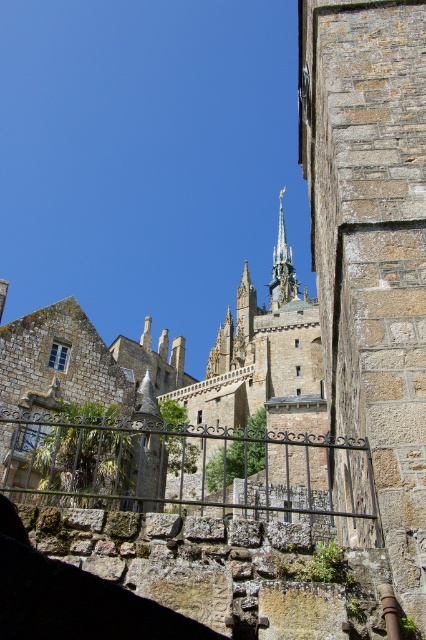
Question: Does stone medieval castle at center appear under polished bronze spire at center?

Choices:
 (A) yes
 (B) no

Answer: (A)

Question: Does stone medieval castle at center come behind polished bronze spire at center?

Choices:
 (A) no
 (B) yes

Answer: (A)

Question: Can you confirm if stone medieval castle at center is positioned below polished bronze spire at center?

Choices:
 (A) yes
 (B) no

Answer: (A)

Question: Among these points, which one is farthest from the camera?

Choices:
 (A) (290, 272)
 (B) (245, 492)

Answer: (A)